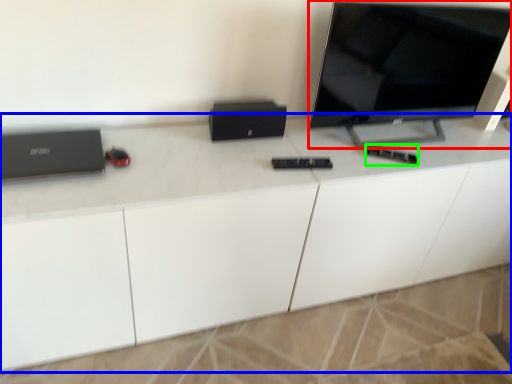
Question: Considering the real-world distances, which object is farthest from television (highlighted by a red box)? desk (highlighted by a blue box) or control (highlighted by a green box)?

Choices:
 (A) desk
 (B) control

Answer: (A)